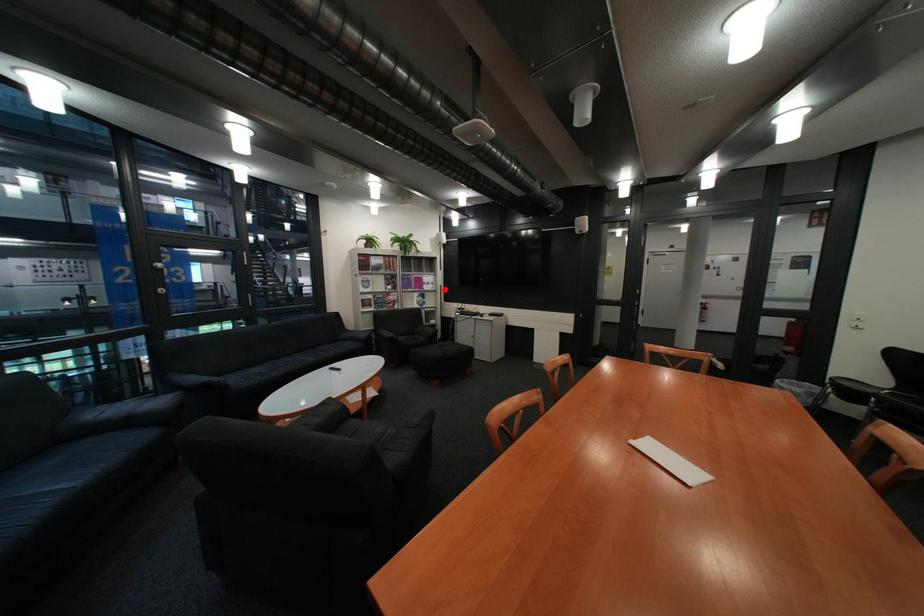
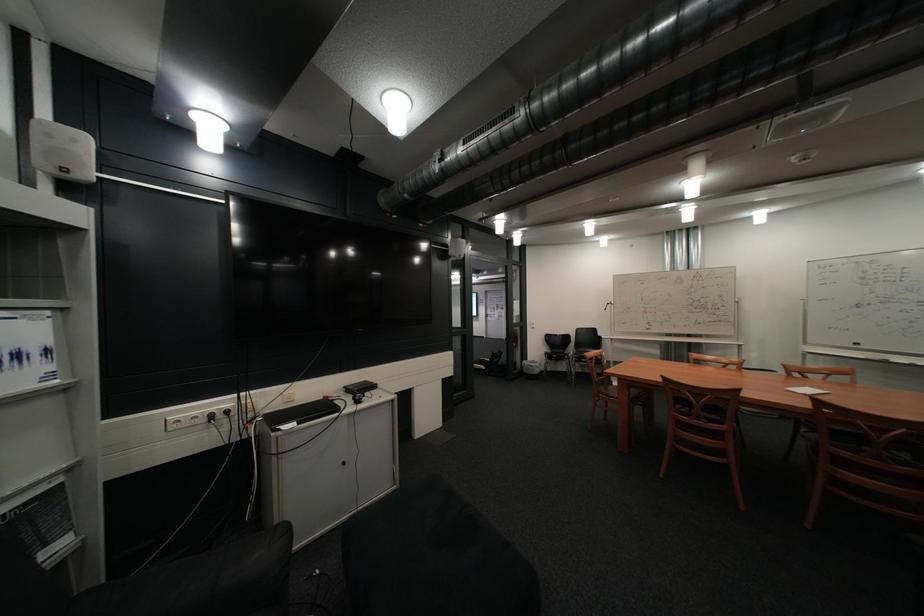
Locate, in the second image, the point that corresponds to the highlighted location in the first image.

(46, 386)